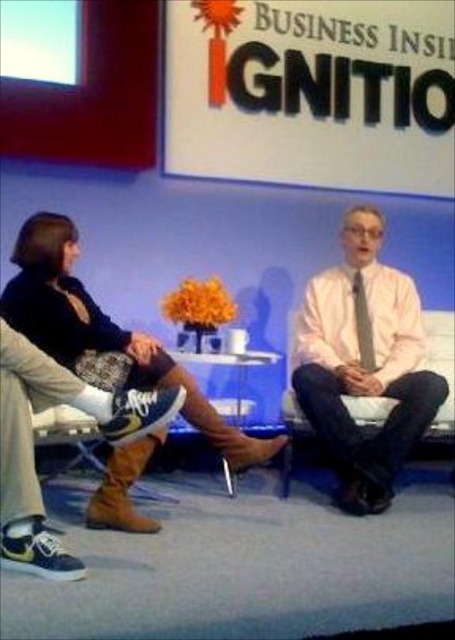
You are a camera operator trying to focus on a specific point in the scene. The point you need to focus on is located at coordinates point [349,419]. Given that the camera can focus on objects within 10 feet, will the camera be able to focus on this point?

The distance of point [349,419] from camera is 9.33 feet, which is within the camera focus range of 10 feet. Therefore, the camera can focus on this point.

You are a fashion designer observing the scene and notice two brown suede boots. The first is labeled as brown suede boots at lower center and the second as brown suede boot at lower left. Which of these two boots is bigger in size?

The brown suede boots at lower center is larger in size compared to the brown suede boot at lower left.

You are a photographer setting up for a group photo. You notice the brown suede boots at lower center and the brown suede boot at lower left in the scene. Which of these two items is covering the other?

The brown suede boots at lower center is positioned over brown suede boot at lower left, so it is covering it.